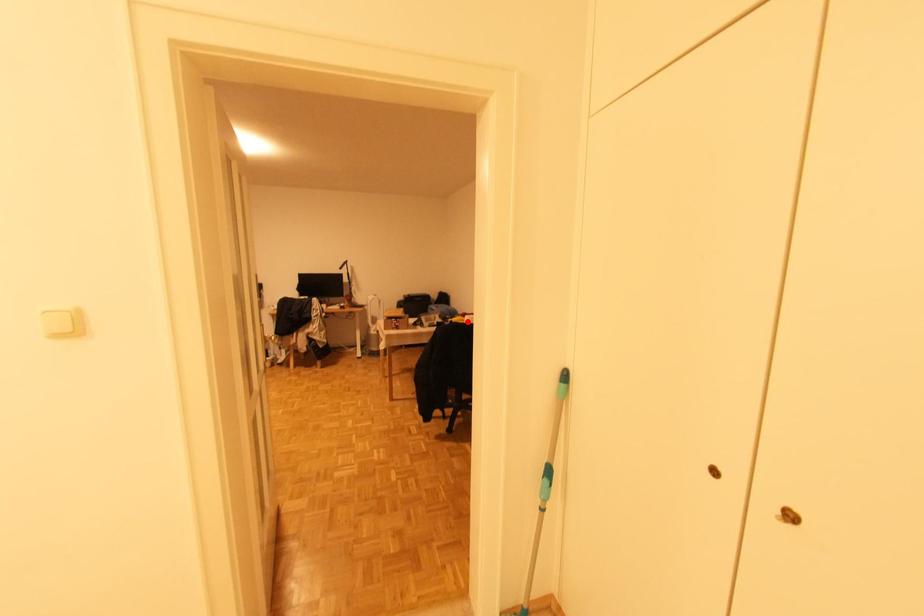
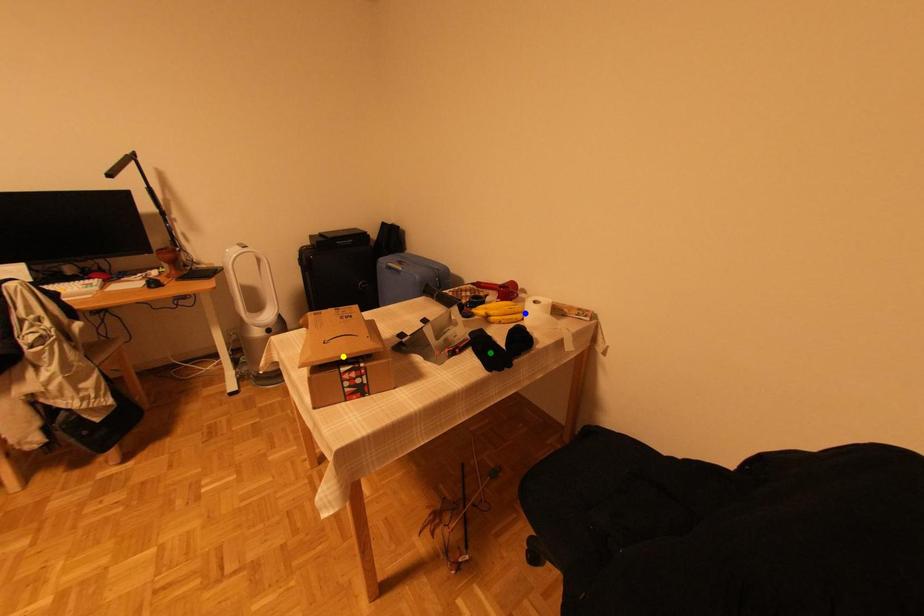
Question: I am providing you with two images of the same scene from different viewpoints. A red point is marked on the first image. You are given multiple points on the second image. Which point in image 2 is actually the same real-world point as the red point in image 1?

Choices:
 (A) yellow point
 (B) blue point
 (C) green point

Answer: (B)